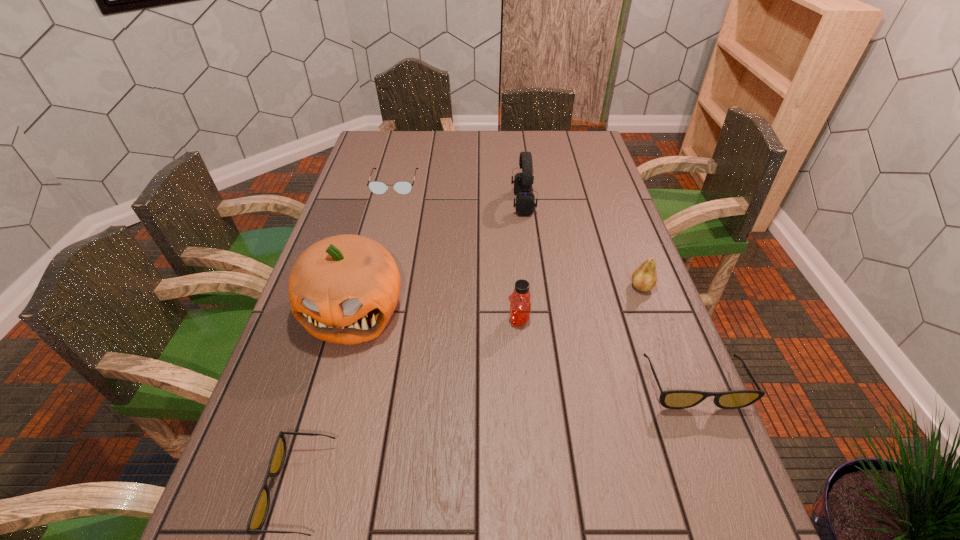
Identify the location of free space located on the headband of the headset. (407, 203).

The image size is (960, 540). What are the coordinates of `free space located 0.170m on the headband of the headset` in the screenshot? It's located at (461, 203).

Identify the location of free point located 0.090m on the headband of the headset. This screenshot has width=960, height=540. (485, 203).

Find the location of a particular element. vacant point located on the front label of the honey is located at coordinates (464, 320).

Identify the location of vacant space located on the front label of the honey. (396, 320).

Where is `vacant space located 0.090m on the front label of the honey`? vacant space located 0.090m on the front label of the honey is located at coordinates (471, 320).

Where is `vacant space located 0.200m on the front of the pear`? vacant space located 0.200m on the front of the pear is located at coordinates coord(668,358).

I want to click on pumpkin at the left edge, so click(343, 289).

Identify the location of spectacles located at the left edge. The height and width of the screenshot is (540, 960). tap(402, 187).

Find the location of `sunglasses at the right edge`. sunglasses at the right edge is located at coordinates (672, 399).